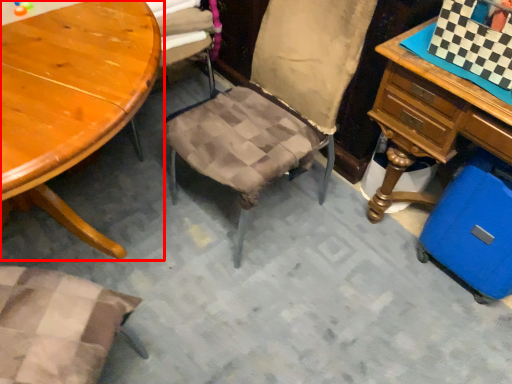
Question: Considering the relative positions of table (annotated by the red box) and luggage in the image provided, where is table (annotated by the red box) located with respect to the staircase?

Choices:
 (A) left
 (B) right

Answer: (A)